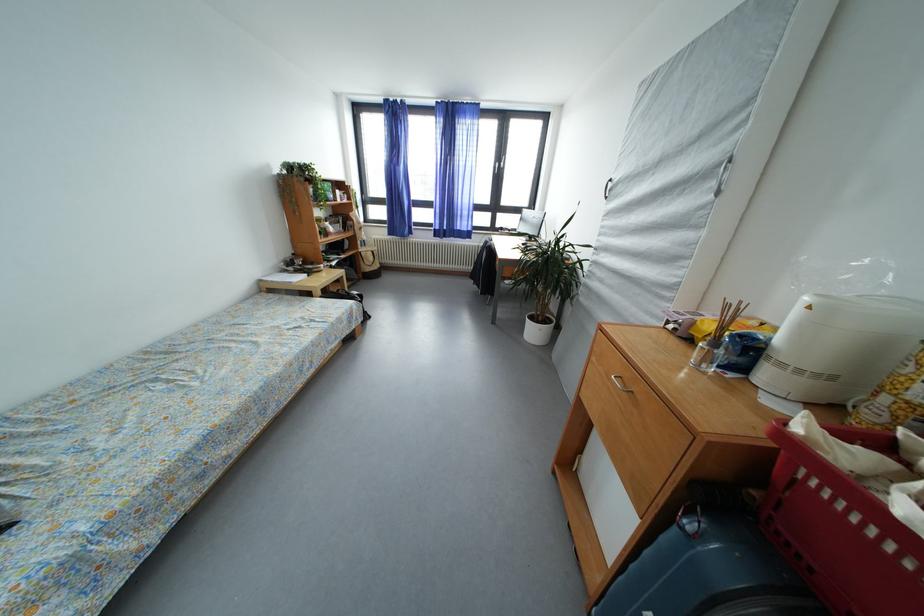
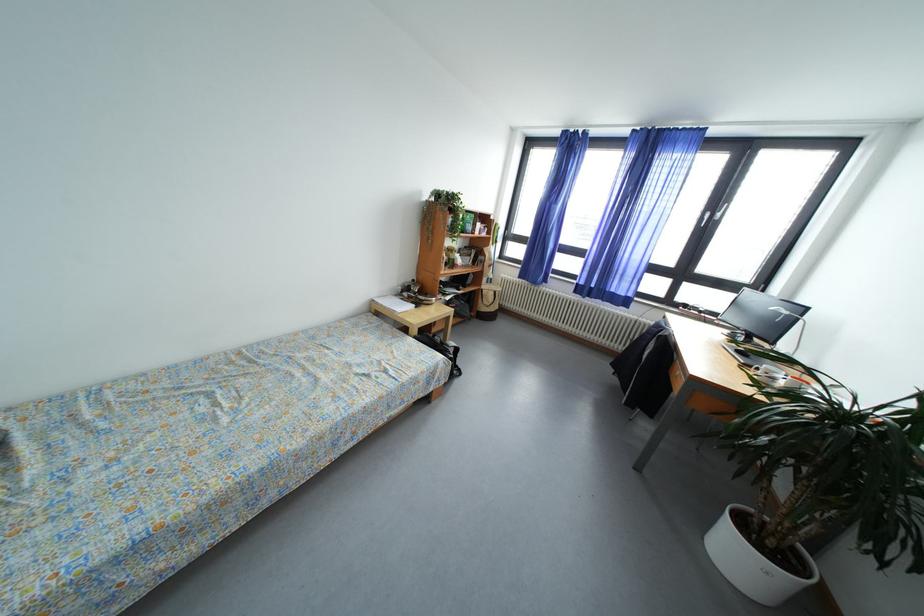
Where in the second image is the point corresponding to (x=540, y=337) from the first image?

(745, 561)